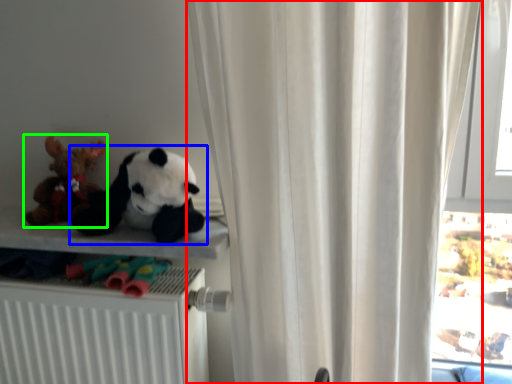
Question: Based on their relative distances, which object is farther from curtain (highlighted by a red box)? Choose from toy (highlighted by a blue box) and toy (highlighted by a green box).

Choices:
 (A) toy
 (B) toy

Answer: (B)